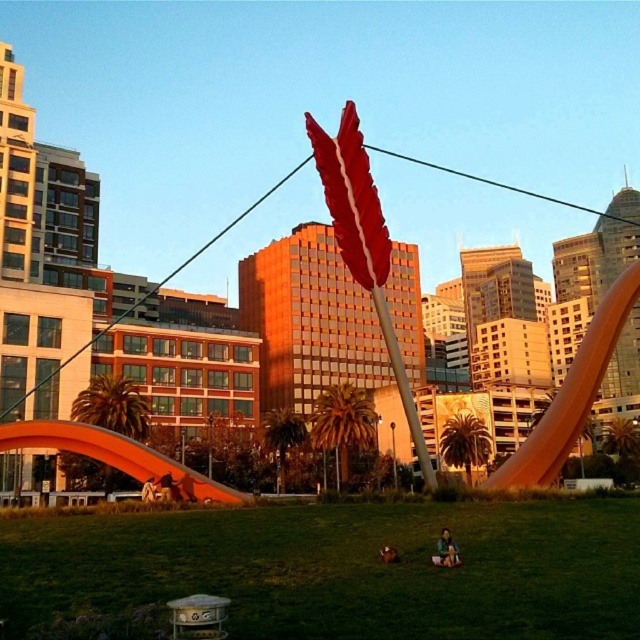
Question: Is green grass at center smaller than brown leather jacket at lower center?

Choices:
 (A) no
 (B) yes

Answer: (A)

Question: Is green grass at center smaller than brown leather jacket at lower center?

Choices:
 (A) no
 (B) yes

Answer: (A)

Question: Can you confirm if green fabric person at lower center is positioned to the right of brown leather jacket at lower center?

Choices:
 (A) no
 (B) yes

Answer: (B)

Question: Estimate the real-world distances between objects in this image. Which object is closer to the green fabric person at lower center?

Choices:
 (A) green grass at center
 (B) brown leather jacket at lower center

Answer: (B)

Question: Based on their relative distances, which object is nearer to the green fabric person at lower center?

Choices:
 (A) brown leather jacket at lower center
 (B) green grass at center

Answer: (A)

Question: Which of the following is the farthest from the observer?

Choices:
 (A) (384, 557)
 (B) (442, 532)
 (C) (230, 518)

Answer: (C)